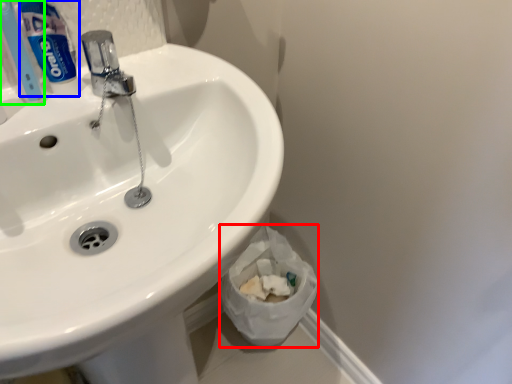
Question: Which object is the farthest from toilet paper (highlighted by a red box)? Choose among these: toothpaste (highlighted by a blue box) or toothbrush (highlighted by a green box).

Choices:
 (A) toothpaste
 (B) toothbrush

Answer: (B)